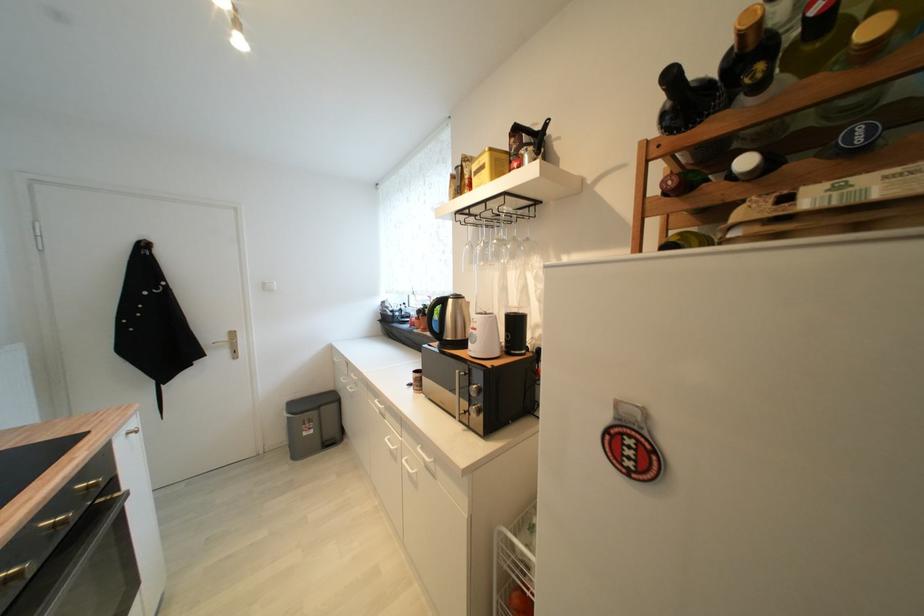
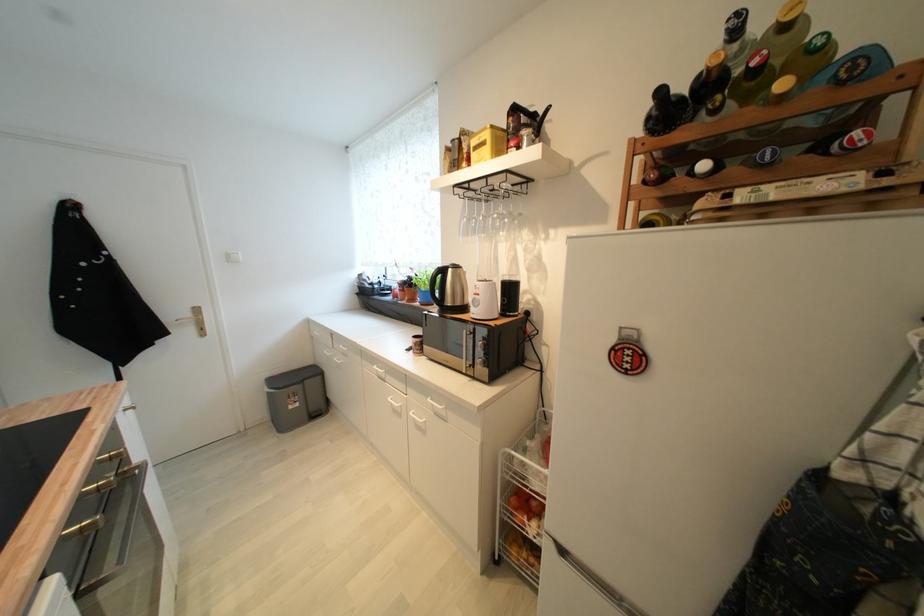
In the second image, find the point that corresponds to (659,193) in the first image.

(641, 182)